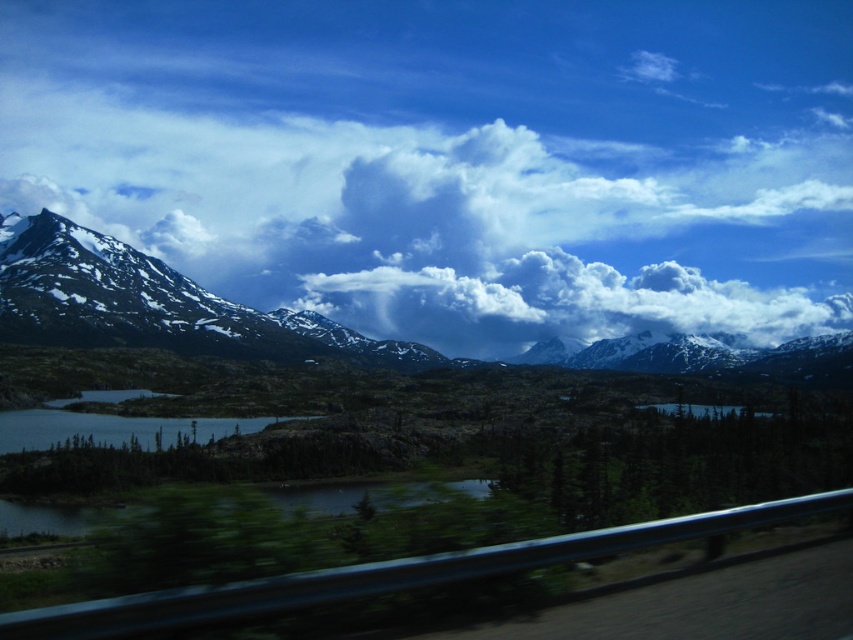
Does white fluffy cloud at upper center appear under white fluffy cloud at center?

Incorrect, white fluffy cloud at upper center is not positioned below white fluffy cloud at center.

Does white fluffy cloud at upper center have a lesser height compared to white fluffy cloud at center?

Incorrect, white fluffy cloud at upper center's height does not fall short of white fluffy cloud at center's.

Which is behind, point (566, 179) or point (590, 296)?

Point (566, 179)

Identify the location of white fluffy cloud at upper center. The height and width of the screenshot is (640, 853). (450, 218).

Find the location of `white fluffy cloud at upper center`. white fluffy cloud at upper center is located at coordinates (450, 218).

You are a GUI agent. You are given a task and a screenshot of the screen. Output one action in this format:
    pyautogui.click(x=<x>, y=<y>)
    Task: Click on the white fluffy cloud at upper center
    This screenshot has height=640, width=853.
    Given the screenshot: What is the action you would take?
    pyautogui.click(x=450, y=218)

Is white fluffy cloud at upper center to the right of snowy rock mountain range at upper left from the viewer's perspective?

Incorrect, white fluffy cloud at upper center is not on the right side of snowy rock mountain range at upper left.

Does white fluffy cloud at upper center appear over snowy rock mountain range at upper left?

Indeed, white fluffy cloud at upper center is positioned over snowy rock mountain range at upper left.

Does point (666, 227) come behind point (828, 336)?

That is True.

The image size is (853, 640). What are the coordinates of `white fluffy cloud at upper center` in the screenshot? It's located at (450, 218).